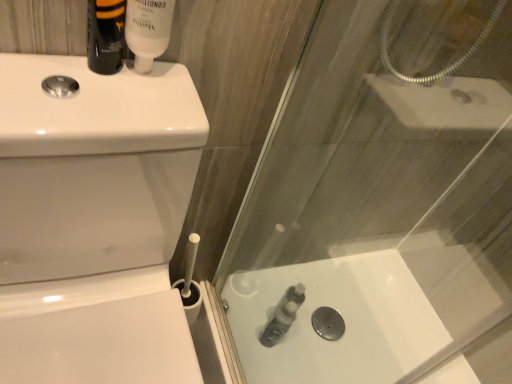
Question: Does matte black bottle at upper left, the 2th toiletry from the top, lie behind translucent plastic bottle at lower center, which is counted as the 3th toiletry, starting from the left?

Choices:
 (A) yes
 (B) no

Answer: (B)

Question: Is matte black bottle at upper left, the 3th toiletry positioned from the back, shorter than translucent plastic bottle at lower center, marked as the 1th toiletry in a bottom-to-top arrangement?

Choices:
 (A) yes
 (B) no

Answer: (A)

Question: Does matte black bottle at upper left, the 1th toiletry positioned from the front, appear on the left side of translucent plastic bottle at lower center, marked as the 1th toiletry in a bottom-to-top arrangement?

Choices:
 (A) yes
 (B) no

Answer: (A)

Question: Is matte black bottle at upper left, the first toiletry viewed from the left, facing towards translucent plastic bottle at lower center, the 1th toiletry positioned from the back?

Choices:
 (A) yes
 (B) no

Answer: (B)

Question: From the image's perspective, does matte black bottle at upper left, the second toiletry in the bottom-to-top sequence, appear higher than translucent plastic bottle at lower center, which is counted as the 3th toiletry, starting from the left?

Choices:
 (A) no
 (B) yes

Answer: (B)

Question: Considering the relative sizes of matte black bottle at upper left, the first toiletry viewed from the left, and translucent plastic bottle at lower center, placed as the third toiletry when sorted from top to bottom, in the image provided, is matte black bottle at upper left, the first toiletry viewed from the left, thinner than translucent plastic bottle at lower center, placed as the third toiletry when sorted from top to bottom,?

Choices:
 (A) no
 (B) yes

Answer: (B)

Question: Is matte black bottle at upper left, the 3th toiletry positioned from the back, smaller than translucent plastic bottle at lower center?

Choices:
 (A) yes
 (B) no

Answer: (A)

Question: Is matte black bottle at upper left, the 3th toiletry when ordered from right to left, beside translucent plastic bottle at lower center?

Choices:
 (A) yes
 (B) no

Answer: (B)

Question: From a real-world perspective, does matte black bottle at upper left, the 1th toiletry positioned from the front, sit lower than translucent plastic bottle at lower center?

Choices:
 (A) yes
 (B) no

Answer: (B)

Question: Is matte black bottle at upper left, the second toiletry in the bottom-to-top sequence, facing towards translucent plastic bottle at lower center?

Choices:
 (A) no
 (B) yes

Answer: (A)

Question: Is translucent plastic bottle at lower center surrounded by matte black bottle at upper left, the 3th toiletry when ordered from right to left?

Choices:
 (A) no
 (B) yes

Answer: (A)

Question: Does matte black bottle at upper left, the 3th toiletry when ordered from right to left, appear on the right side of translucent plastic bottle at lower center?

Choices:
 (A) no
 (B) yes

Answer: (A)

Question: Does translucent plastic bottle at lower center, the 1th toiletry positioned from the back, appear on the left side of matte black bottle at upper left, the second toiletry in the bottom-to-top sequence?

Choices:
 (A) no
 (B) yes

Answer: (A)